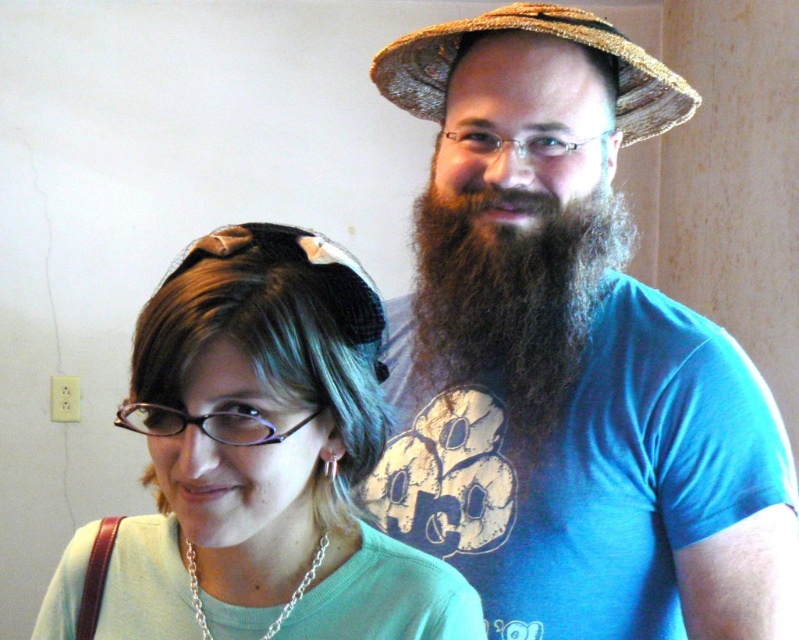
You are standing in the room and want to determine which of the two points, point (535,413) or point (642,56), is closer to you. Based on the scene, which one is nearer?

Point (535,413) is closer to you than point (642,56) because it is further to the viewer in the image.

You are trying to decide which object is narrower between the brown fuzzy beard at right and the woven straw hat at upper center. Based on the scene, which one is narrower?

The brown fuzzy beard at right is narrower than the woven straw hat at upper center.